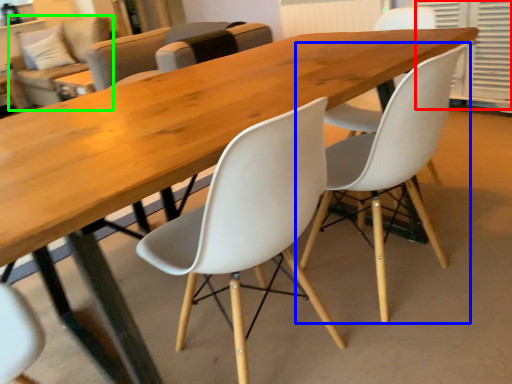
Question: Estimate the real-world distances between objects in this image. Which object is closer to shutter (highlighted by a red box), chair (highlighted by a blue box) or couch (highlighted by a green box)?

Choices:
 (A) chair
 (B) couch

Answer: (A)